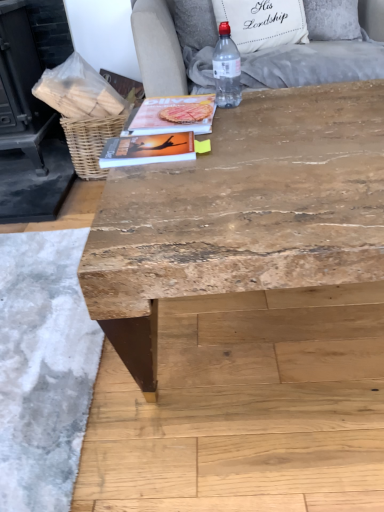
Question: Is matte paper magazine at center, marked as the first magazine in a top-to-bottom arrangement, bigger than light gray fabric armchair at upper center?

Choices:
 (A) no
 (B) yes

Answer: (A)

Question: Considering the relative positions of matte paper magazine at center, marked as the first magazine in a top-to-bottom arrangement, and light gray fabric armchair at upper center in the image provided, is matte paper magazine at center, marked as the first magazine in a top-to-bottom arrangement, to the right of light gray fabric armchair at upper center from the viewer's perspective?

Choices:
 (A) yes
 (B) no

Answer: (B)

Question: Does matte paper magazine at center, marked as the first magazine in a top-to-bottom arrangement, have a lesser width compared to light gray fabric armchair at upper center?

Choices:
 (A) no
 (B) yes

Answer: (B)

Question: Are matte paper magazine at center, marked as the first magazine in a top-to-bottom arrangement, and light gray fabric armchair at upper center far apart?

Choices:
 (A) yes
 (B) no

Answer: (B)

Question: Are matte paper magazine at center, the second magazine from the front, and light gray fabric armchair at upper center beside each other?

Choices:
 (A) no
 (B) yes

Answer: (A)

Question: Is matte paper magazine at center, placed as the second magazine when sorted from bottom to top, to the left of light gray fabric armchair at upper center from the viewer's perspective?

Choices:
 (A) yes
 (B) no

Answer: (A)

Question: Is woven brown basket at upper left behind light gray fabric armchair at upper center?

Choices:
 (A) no
 (B) yes

Answer: (B)

Question: Does woven brown basket at upper left have a larger size compared to light gray fabric armchair at upper center?

Choices:
 (A) no
 (B) yes

Answer: (A)

Question: Is light gray fabric armchair at upper center at the back of woven brown basket at upper left?

Choices:
 (A) no
 (B) yes

Answer: (A)

Question: Is woven brown basket at upper left in front of light gray fabric armchair at upper center?

Choices:
 (A) no
 (B) yes

Answer: (A)

Question: Considering the relative sizes of woven brown basket at upper left and light gray fabric armchair at upper center in the image provided, is woven brown basket at upper left shorter than light gray fabric armchair at upper center?

Choices:
 (A) no
 (B) yes

Answer: (B)

Question: Can you confirm if woven brown basket at upper left is smaller than light gray fabric armchair at upper center?

Choices:
 (A) no
 (B) yes

Answer: (B)

Question: Does light gray fabric armchair at upper center come in front of white fabric pillow at upper center?

Choices:
 (A) yes
 (B) no

Answer: (A)